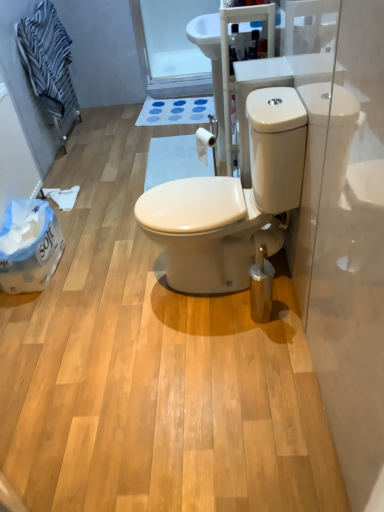
Question: Does transparent glass door at upper center appear on the right side of blue striped towel at upper left?

Choices:
 (A) no
 (B) yes

Answer: (B)

Question: From the image's perspective, is transparent glass door at upper center under blue striped towel at upper left?

Choices:
 (A) no
 (B) yes

Answer: (A)

Question: Is transparent glass door at upper center further to the viewer compared to blue striped towel at upper left?

Choices:
 (A) yes
 (B) no

Answer: (A)

Question: Can you confirm if transparent glass door at upper center is thinner than blue striped towel at upper left?

Choices:
 (A) no
 (B) yes

Answer: (B)

Question: Does transparent glass door at upper center have a greater width compared to blue striped towel at upper left?

Choices:
 (A) yes
 (B) no

Answer: (B)

Question: Can you confirm if transparent glass door at upper center is bigger than blue striped towel at upper left?

Choices:
 (A) no
 (B) yes

Answer: (A)

Question: Is white glossy toilet at center positioned before white matte toilet paper at upper center?

Choices:
 (A) yes
 (B) no

Answer: (A)

Question: Is white glossy toilet at center aimed at white matte toilet paper at upper center?

Choices:
 (A) yes
 (B) no

Answer: (B)

Question: From the image's perspective, would you say white glossy toilet at center is shown under white matte toilet paper at upper center?

Choices:
 (A) yes
 (B) no

Answer: (A)

Question: Can white matte toilet paper at upper center be found inside white glossy toilet at center?

Choices:
 (A) no
 (B) yes

Answer: (A)

Question: Would you say white glossy toilet at center is outside white matte toilet paper at upper center?

Choices:
 (A) no
 (B) yes

Answer: (B)

Question: Does white glossy toilet at center have a larger size compared to white matte toilet paper at upper center?

Choices:
 (A) yes
 (B) no

Answer: (A)

Question: Does transparent glass door at upper center appear on the right side of white glossy toilet at center?

Choices:
 (A) yes
 (B) no

Answer: (B)